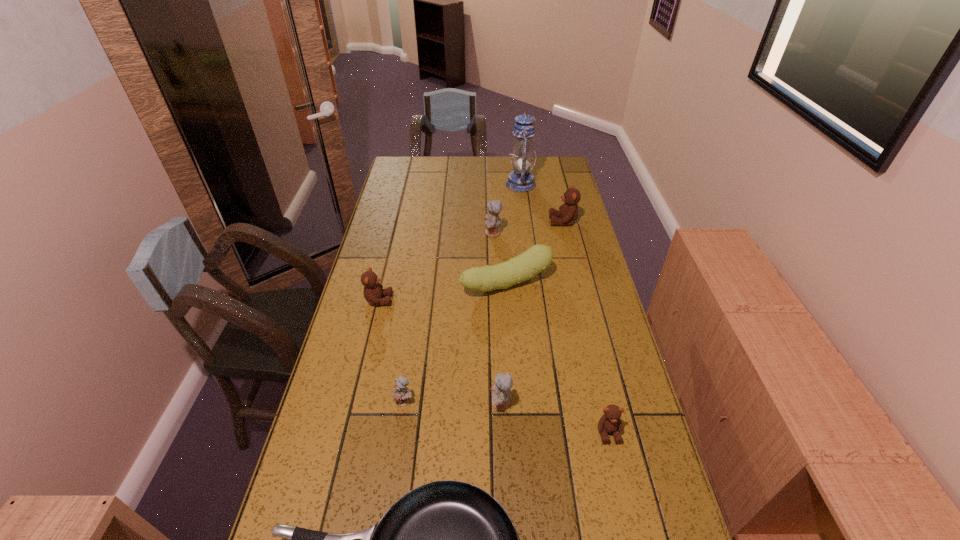
At what (x,y) coordinates should I click in order to perform the action: click on object that is the sixth closest one to the second nearest object. Please return your answer as a coordinate pair (x, y). The image size is (960, 540). Looking at the image, I should click on (492, 220).

You are a GUI agent. You are given a task and a screenshot of the screen. Output one action in this format:
    pyautogui.click(x=<x>, y=<y>)
    Task: Click on the object that stands as the third closest to the nearest object
    
    Given the screenshot: What is the action you would take?
    pyautogui.click(x=610, y=422)

At what (x,y) coordinates should I click in order to perform the action: click on teddy bear that is the third closest to the shortest object. Please return your answer as a coordinate pair (x, y). The height and width of the screenshot is (540, 960). Looking at the image, I should click on (610, 422).

Select which teddy bear is the sixth closest to the cucumber. Please provide its 2D coordinates. Your answer should be formatted as a tuple, i.e. [(x, y)], where the tuple contains the x and y coordinates of a point satisfying the conditions above.

[(610, 422)]

Find the location of `blue teddy bear that is the third closest one to the farthest brown teddy bear`. blue teddy bear that is the third closest one to the farthest brown teddy bear is located at coordinates (402, 395).

Where is `blue teddy bear that stands as the second closest to the second smallest blue teddy bear`? blue teddy bear that stands as the second closest to the second smallest blue teddy bear is located at coordinates (492, 220).

What are the coordinates of `brown teddy bear that is the second closest to the fifth teddy bear from right to left` in the screenshot? It's located at (610, 422).

Select which brown teddy bear is the second closest to the second smallest blue teddy bear. Please provide its 2D coordinates. Your answer should be formatted as a tuple, i.e. [(x, y)], where the tuple contains the x and y coordinates of a point satisfying the conditions above.

[(373, 291)]

This screenshot has width=960, height=540. Find the location of `vacant area in the image that satisfies the following two spatial constraints: 1. on the front-facing side of the biggest blue teddy bear; 2. on the right side of the cucumber`. vacant area in the image that satisfies the following two spatial constraints: 1. on the front-facing side of the biggest blue teddy bear; 2. on the right side of the cucumber is located at coordinates (494, 284).

Find the location of a particular element. The width and height of the screenshot is (960, 540). vacant space that satisfies the following two spatial constraints: 1. on the front side of the green cucumber; 2. on the face of the second nearest brown teddy bear is located at coordinates (508, 300).